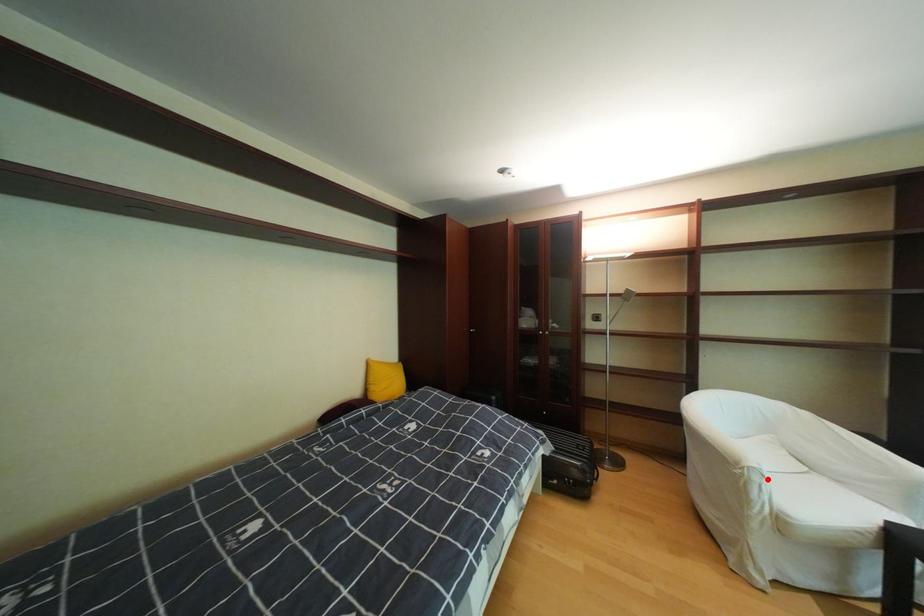
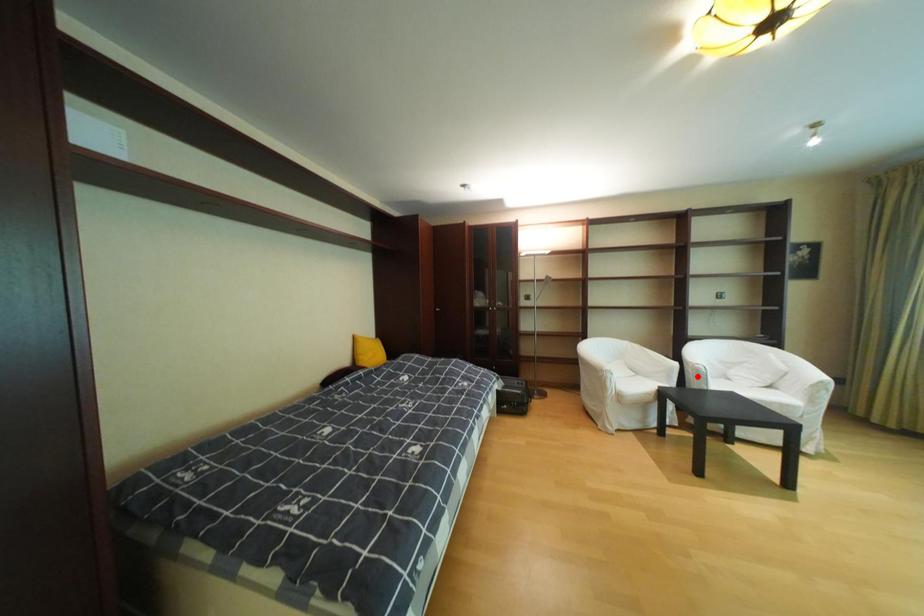
In the scene shown: I am providing you with two images of the same scene from different viewpoints. A red point is marked on the first image and another point is marked on the second image. Are the points marked in image1 and image2 representing the same 3D position?

No